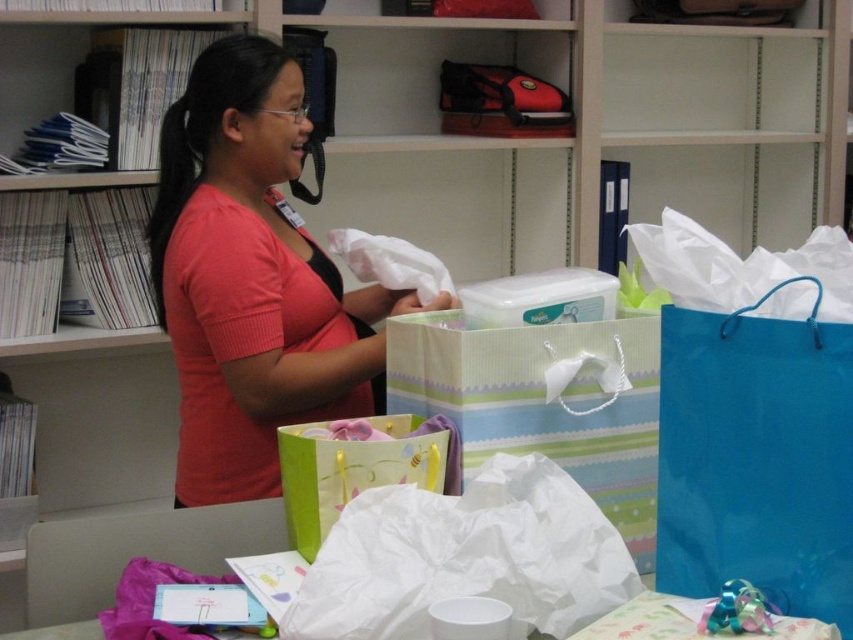
Who is positioned more to the left, pink matte shirt at center or blue glossy shopping bag at center right?

pink matte shirt at center is more to the left.

Can you confirm if pink matte shirt at center is positioned to the left of blue glossy shopping bag at center right?

A: Yes, pink matte shirt at center is to the left of blue glossy shopping bag at center right.

Is point (166, 164) less distant than point (815, 612)?

No.

You are a GUI agent. You are given a task and a screenshot of the screen. Output one action in this format:
    pyautogui.click(x=<x>, y=<y>)
    Task: Click on the pink matte shirt at center
    This screenshot has height=640, width=853.
    Given the screenshot: What is the action you would take?
    pyautogui.click(x=252, y=278)

Who is more forward, (302,230) or (337,474)?

Positioned in front is point (337,474).

Consider the image. Who is lower down, pink matte shirt at center or matte green paper bag at center?

matte green paper bag at center is below.

Is point (198, 465) in front of point (314, 509)?

No, (198, 465) is behind (314, 509).

Identify the location of pink matte shirt at center. (252, 278).

Who is positioned more to the right, matte green paper bag at center or matte black bag at upper center?

Positioned to the right is matte black bag at upper center.

Which is in front, point (289, 436) or point (485, 124)?

Point (289, 436)

Locate an element on the screen. The image size is (853, 640). matte green paper bag at center is located at coordinates (347, 472).